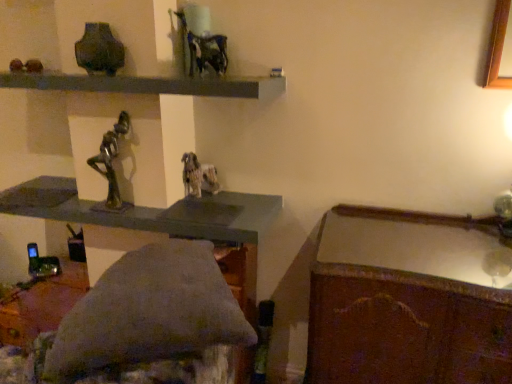
In order to face matte dark green vase at upper left, should I rotate leftwards or rightwards?

Turn left by 19.752 degrees to look at matte dark green vase at upper left.

This screenshot has width=512, height=384. In order to click on smooth gray shelf at upper center in this screenshot , I will do `click(149, 84)`.

Is matte dark green vase at upper left touching wooden polished desk at lower right?

No, matte dark green vase at upper left is not with wooden polished desk at lower right.

Consider the image. Considering the relative sizes of matte dark green vase at upper left and wooden polished desk at lower right in the image provided, is matte dark green vase at upper left shorter than wooden polished desk at lower right?

Yes, matte dark green vase at upper left is shorter than wooden polished desk at lower right.

Looking at their sizes, would you say matte dark green vase at upper left is wider or thinner than wooden polished desk at lower right?

In the image, matte dark green vase at upper left appears to be more narrow than wooden polished desk at lower right.

Is point (117, 189) closer to camera compared to point (62, 81)?

No.

Is bronze statue at center bigger or smaller than smooth gray shelf at upper center?

bronze statue at center is smaller than smooth gray shelf at upper center.

Looking at their sizes, would you say bronze statue at center is wider or thinner than smooth gray shelf at upper center?

In the image, bronze statue at center appears to be more narrow than smooth gray shelf at upper center.

In the scene shown: From the image's perspective, is bronze statue at center located above or below smooth gray shelf at upper center?

Based on their image positions, bronze statue at center is located beneath smooth gray shelf at upper center.

Is smooth gray shelf at upper center completely or partially inside matte dark green vase at upper left?

No, matte dark green vase at upper left does not contain smooth gray shelf at upper center.

Between matte dark green vase at upper left and smooth gray shelf at upper center, which one appears on the left side from the viewer's perspective?

From the viewer's perspective, matte dark green vase at upper left appears more on the left side.

Is point (87, 42) farther from viewer compared to point (127, 84)?

That is True.

Is matte dark green vase at upper left positioned with its back to smooth gray shelf at upper center?

Absolutely, matte dark green vase at upper left is directed away from smooth gray shelf at upper center.

From a real-world perspective, which is physically below, smooth gray shelf at upper center or matte dark green vase at upper left?

From a 3D spatial view, smooth gray shelf at upper center is below.

Considering the sizes of objects smooth gray shelf at upper center and matte dark green vase at upper left in the image provided, who is bigger, smooth gray shelf at upper center or matte dark green vase at upper left?

With larger size is smooth gray shelf at upper center.

Can we say smooth gray shelf at upper center lies outside matte dark green vase at upper left?

Yes, smooth gray shelf at upper center is located beyond the bounds of matte dark green vase at upper left.

From the image's perspective, which is below, smooth gray shelf at upper center or matte dark green vase at upper left?

smooth gray shelf at upper center, from the image's perspective.

From the image's perspective, is bronze statue at center above or below wooden polished desk at lower right?

bronze statue at center is above wooden polished desk at lower right.

Would you say bronze statue at center contains wooden polished desk at lower right?

No.

The width and height of the screenshot is (512, 384). I want to click on writing desk below the bronze statue at center (from a real-world perspective), so click(409, 299).

In the scene shown: From a real-world perspective, is bronze statue at center located beneath wooden polished desk at lower right?

No, from a real-world perspective, bronze statue at center is not beneath wooden polished desk at lower right.

From the picture: Considering the relative sizes of smooth gray shelf at upper center and bronze statue at center in the image provided, is smooth gray shelf at upper center smaller than bronze statue at center?

No.

Based on the photo, from the image's perspective, is smooth gray shelf at upper center over bronze statue at center?

Yes, from the image's perspective, smooth gray shelf at upper center is above bronze statue at center.

From a real-world perspective, between smooth gray shelf at upper center and bronze statue at center, who is vertically lower?

bronze statue at center is physically lower.

Which is less distant, (0, 75) or (128, 129)?

The point (128, 129) is closer to the camera.

Are wooden polished desk at lower right and bronze statue at center far apart?

Indeed, wooden polished desk at lower right is not near bronze statue at center.

Considering the positions of objects wooden polished desk at lower right and bronze statue at center in the image provided, who is more to the right, wooden polished desk at lower right or bronze statue at center?

From the viewer's perspective, wooden polished desk at lower right appears more on the right side.

Is wooden polished desk at lower right further to the viewer compared to bronze statue at center?

No, wooden polished desk at lower right is closer to the viewer.

Locate an element on the screen. vase on the left of wooden polished desk at lower right is located at coordinates (99, 50).

Image resolution: width=512 pixels, height=384 pixels. I want to click on figurine behind the smooth gray shelf at upper center, so click(111, 159).

Looking at the image, which one is located closer to wooden polished desk at lower right, matte dark green vase at upper left or bronze statue at center?

bronze statue at center is closer to wooden polished desk at lower right.

Looking at the image, which one is located further to smooth gray shelf at upper center, matte dark green vase at upper left or wooden polished desk at lower right?

Based on the image, wooden polished desk at lower right appears to be further to smooth gray shelf at upper center.

From the image, which object appears to be farther from smooth gray shelf at upper center, bronze statue at center or matte dark green vase at upper left?

A: Based on the image, bronze statue at center appears to be further to smooth gray shelf at upper center.

From the image, which object appears to be nearer to wooden polished desk at lower right, smooth gray shelf at upper center or bronze statue at center?

smooth gray shelf at upper center lies closer to wooden polished desk at lower right than the other object.

Which object lies nearer to the anchor point wooden polished desk at lower right, bronze statue at center or matte dark green vase at upper left?

The object closer to wooden polished desk at lower right is bronze statue at center.

Estimate the real-world distances between objects in this image. Which object is closer to matte dark green vase at upper left, wooden polished desk at lower right or smooth gray shelf at upper center?

smooth gray shelf at upper center lies closer to matte dark green vase at upper left than the other object.

From the image, which object appears to be farther from smooth gray shelf at upper center, matte dark green vase at upper left or bronze statue at center?

bronze statue at center.

Looking at the image, which one is located closer to matte dark green vase at upper left, bronze statue at center or wooden polished desk at lower right?

bronze statue at center lies closer to matte dark green vase at upper left than the other object.

Where is `shelf between matte dark green vase at upper left and bronze statue at center from top to bottom`? shelf between matte dark green vase at upper left and bronze statue at center from top to bottom is located at coordinates (149, 84).

At what (x,y) coordinates should I click in order to perform the action: click on shelf between matte dark green vase at upper left and wooden polished desk at lower right from left to right. Please return your answer as a coordinate pair (x, y). The width and height of the screenshot is (512, 384). Looking at the image, I should click on (149, 84).

At what (x,y) coordinates should I click in order to perform the action: click on shelf located between bronze statue at center and wooden polished desk at lower right in the left-right direction. Please return your answer as a coordinate pair (x, y). The width and height of the screenshot is (512, 384). Looking at the image, I should click on (149, 84).

Where is `vase between bronze statue at center and wooden polished desk at lower right in the horizontal direction`? vase between bronze statue at center and wooden polished desk at lower right in the horizontal direction is located at coordinates (99, 50).